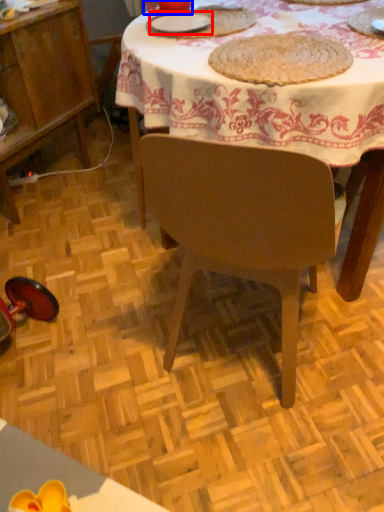
Question: Which of the following is the farthest to the observer, tableware (highlighted by a red box) or tableware (highlighted by a blue box)?

Choices:
 (A) tableware
 (B) tableware

Answer: (B)